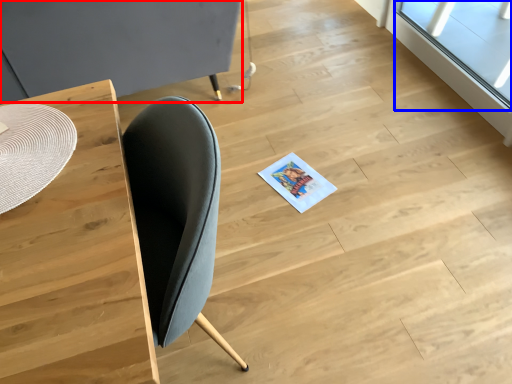
Question: Among these objects, which one is nearest to the camera, round table (highlighted by a red box) or window (highlighted by a blue box)?

Choices:
 (A) round table
 (B) window

Answer: (A)